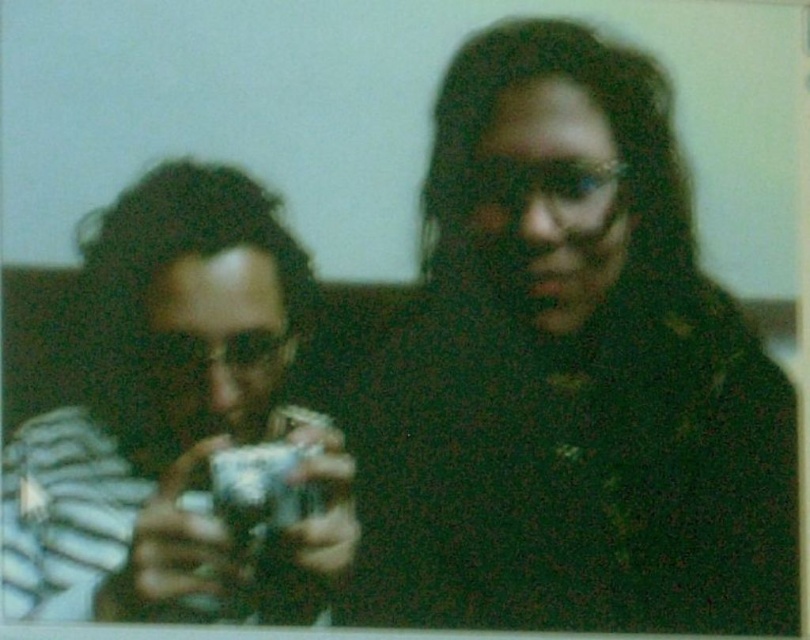
Question: Is black matte sweater at center below metallic silver camera at left?

Choices:
 (A) yes
 (B) no

Answer: (B)

Question: Which point appears farthest from the camera in this image?

Choices:
 (A) (312, 468)
 (B) (531, 296)

Answer: (B)

Question: Is the position of black matte sweater at center more distant than that of metallic silver camera at left?

Choices:
 (A) no
 (B) yes

Answer: (B)

Question: Among these objects, which one is nearest to the camera?

Choices:
 (A) black matte sweater at center
 (B) metallic silver camera at left

Answer: (B)

Question: Is black matte sweater at center positioned before metallic silver camera at left?

Choices:
 (A) no
 (B) yes

Answer: (A)